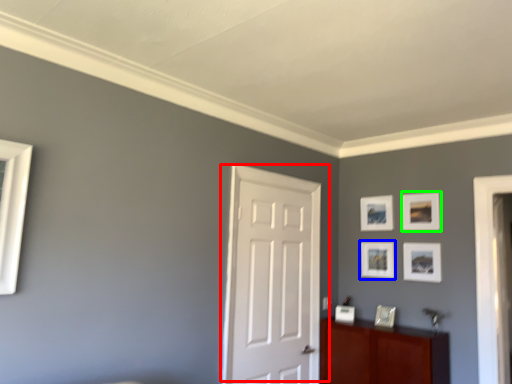
Question: Which is nearer to the door (highlighted by a red box)? picture frame (highlighted by a blue box) or picture frame (highlighted by a green box).

Choices:
 (A) picture frame
 (B) picture frame

Answer: (A)